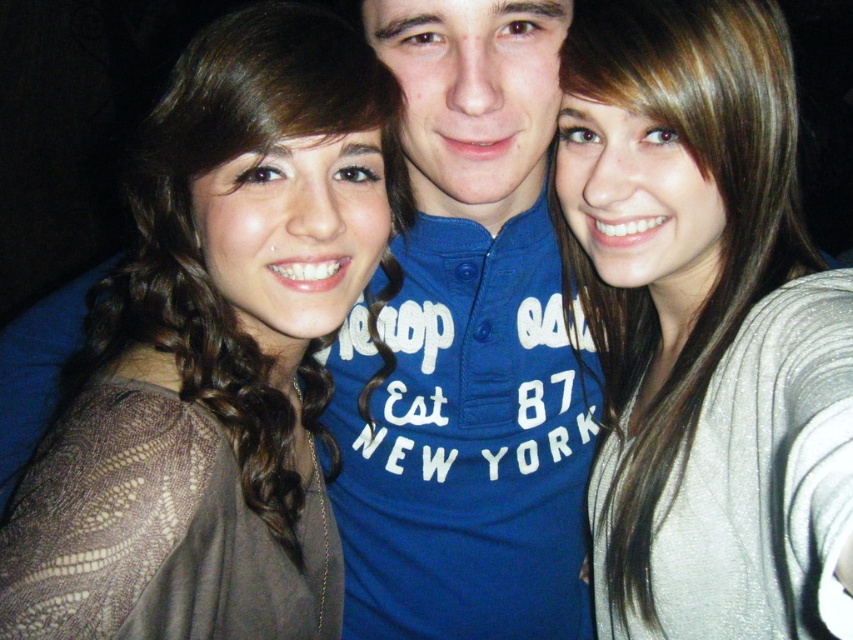
Looking at this image, can you confirm if satin silver sweater at center is positioned to the right of blue cotton shirt at center?

Correct, you'll find satin silver sweater at center to the right of blue cotton shirt at center.

Is point (753, 596) more distant than point (480, 148)?

Yes, it is.

Identify the location of satin silver sweater at center. (704, 326).

Which is in front, point (718, 80) or point (247, 348)?

Positioned in front is point (718, 80).

Is satin silver sweater at center thinner than brown lace top at left?

Yes.

Is point (813, 593) farther from camera compared to point (149, 324)?

No, (813, 593) is in front of (149, 324).

Locate an element on the screen. satin silver sweater at center is located at coordinates (704, 326).

Based on the photo, can you confirm if blue cotton shirt at center is shorter than brown lace top at left?

No, blue cotton shirt at center is not shorter than brown lace top at left.

Identify the location of blue cotton shirt at center. (468, 349).

Between point (393, 68) and point (138, 602), which one is positioned behind?

Point (393, 68)

Locate an element on the screen. blue cotton shirt at center is located at coordinates (468, 349).